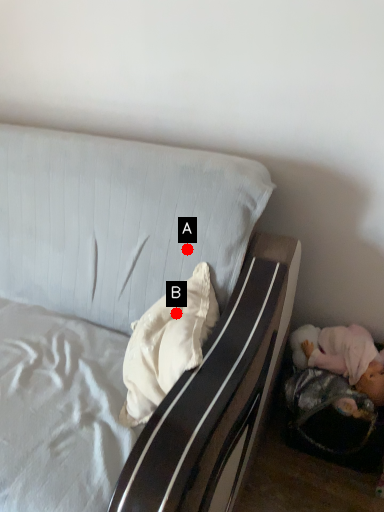
Question: Two points are circled on the image, labeled by A and B beside each circle. Which point is closer to the camera?

Choices:
 (A) A is closer
 (B) B is closer

Answer: (B)